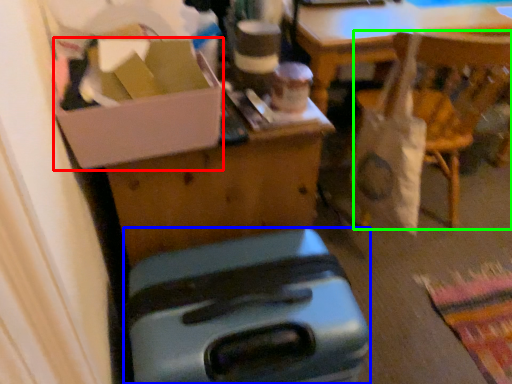
Question: Which object is positioned closest to box (highlighted by a red box)? Select from luggage (highlighted by a blue box) and chair (highlighted by a green box).

Choices:
 (A) luggage
 (B) chair

Answer: (A)